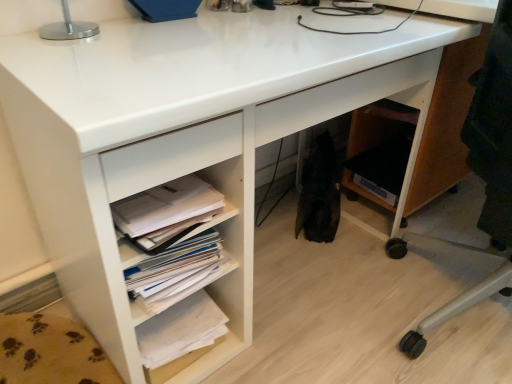
Question: From the image's perspective, does white paper stack at lower center, marked as the 1th book in a top-to-bottom arrangement, appear lower than white paper at lower left?

Choices:
 (A) no
 (B) yes

Answer: (B)

Question: Is the position of white paper stack at lower center, placed as the second book when sorted from bottom to top, more distant than that of white paper at lower left?

Choices:
 (A) no
 (B) yes

Answer: (B)

Question: Is the depth of white paper stack at lower center, marked as the 1th book in a top-to-bottom arrangement, less than that of white paper at lower left?

Choices:
 (A) yes
 (B) no

Answer: (B)

Question: From a real-world perspective, is white paper stack at lower center, marked as the 1th book in a top-to-bottom arrangement, below white paper at lower left?

Choices:
 (A) no
 (B) yes

Answer: (B)

Question: Can you confirm if white paper stack at lower center, marked as the 1th book in a top-to-bottom arrangement, is taller than white paper at lower left?

Choices:
 (A) no
 (B) yes

Answer: (B)

Question: From their relative heights in the image, would you say white paper stack at lower left, placed as the 1th book when sorted from bottom to top, is taller or shorter than white paper stack at lower center, marked as the 1th book in a top-to-bottom arrangement?

Choices:
 (A) tall
 (B) short

Answer: (B)

Question: Considering the positions of white paper stack at lower left, placed as the 1th book when sorted from bottom to top, and white paper stack at lower center, marked as the 1th book in a top-to-bottom arrangement, in the image, is white paper stack at lower left, placed as the 1th book when sorted from bottom to top, wider or thinner than white paper stack at lower center, marked as the 1th book in a top-to-bottom arrangement,?

Choices:
 (A) thin
 (B) wide

Answer: (B)

Question: Choose the correct answer: Is white paper stack at lower left, which appears as the second book when viewed from the top, inside white paper stack at lower center, marked as the 1th book in a top-to-bottom arrangement, or outside it?

Choices:
 (A) outside
 (B) inside

Answer: (A)

Question: Considering the relative positions of white paper stack at lower left, which appears as the second book when viewed from the top, and white paper stack at lower center, placed as the second book when sorted from bottom to top, in the image provided, is white paper stack at lower left, which appears as the second book when viewed from the top, to the left or to the right of white paper stack at lower center, placed as the second book when sorted from bottom to top,?

Choices:
 (A) left
 (B) right

Answer: (A)

Question: From a real-world perspective, is white paper stack at lower left, placed as the 1th book when sorted from bottom to top, positioned above or below wooden office chair at lower right?

Choices:
 (A) below
 (B) above

Answer: (A)

Question: From the image's perspective, is white paper stack at lower left, placed as the 1th book when sorted from bottom to top, above or below wooden office chair at lower right?

Choices:
 (A) above
 (B) below

Answer: (B)

Question: Would you say white paper stack at lower left, which appears as the second book when viewed from the top, is inside or outside wooden office chair at lower right?

Choices:
 (A) inside
 (B) outside

Answer: (B)

Question: Considering the positions of point (196, 301) and point (505, 84), is point (196, 301) closer or farther from the camera than point (505, 84)?

Choices:
 (A) closer
 (B) farther

Answer: (B)

Question: From the image's perspective, is white paper at lower left located above or below wooden office chair at lower right?

Choices:
 (A) above
 (B) below

Answer: (B)

Question: In the image, is white paper at lower left positioned in front of or behind wooden office chair at lower right?

Choices:
 (A) front
 (B) behind

Answer: (B)